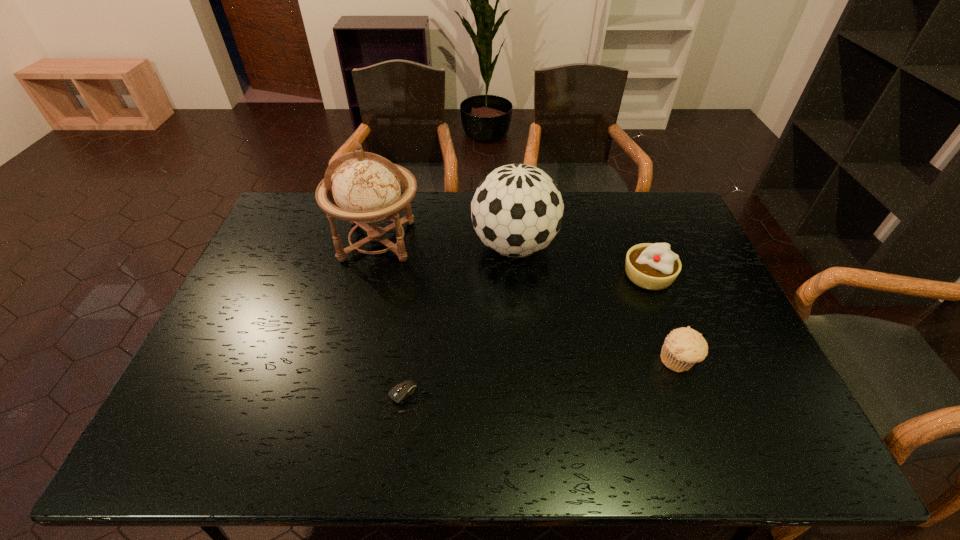
The width and height of the screenshot is (960, 540). I want to click on globe, so click(366, 188).

Locate an element on the screen. The height and width of the screenshot is (540, 960). the third object from right to left is located at coordinates (517, 210).

This screenshot has width=960, height=540. I want to click on soccer ball, so 517,210.

Image resolution: width=960 pixels, height=540 pixels. What are the coordinates of `whipped cream` in the screenshot? It's located at (650, 266).

Identify the location of the fourth tallest object. (683, 347).

Locate an element on the screen. The height and width of the screenshot is (540, 960). muffin is located at coordinates (683, 347).

You are a GUI agent. You are given a task and a screenshot of the screen. Output one action in this format:
    pyautogui.click(x=<x>, y=<y>)
    Task: Click on the nearest object
    This screenshot has width=960, height=540.
    Given the screenshot: What is the action you would take?
    pyautogui.click(x=401, y=391)

Image resolution: width=960 pixels, height=540 pixels. Find the location of `computer mouse`. computer mouse is located at coordinates (401, 391).

Where is `vacant space located 0.240m on the front-facing side of the tallest object`? This screenshot has width=960, height=540. vacant space located 0.240m on the front-facing side of the tallest object is located at coordinates (354, 334).

Where is `vacant space situated on the front of the third object from right to left`? This screenshot has height=540, width=960. vacant space situated on the front of the third object from right to left is located at coordinates (522, 345).